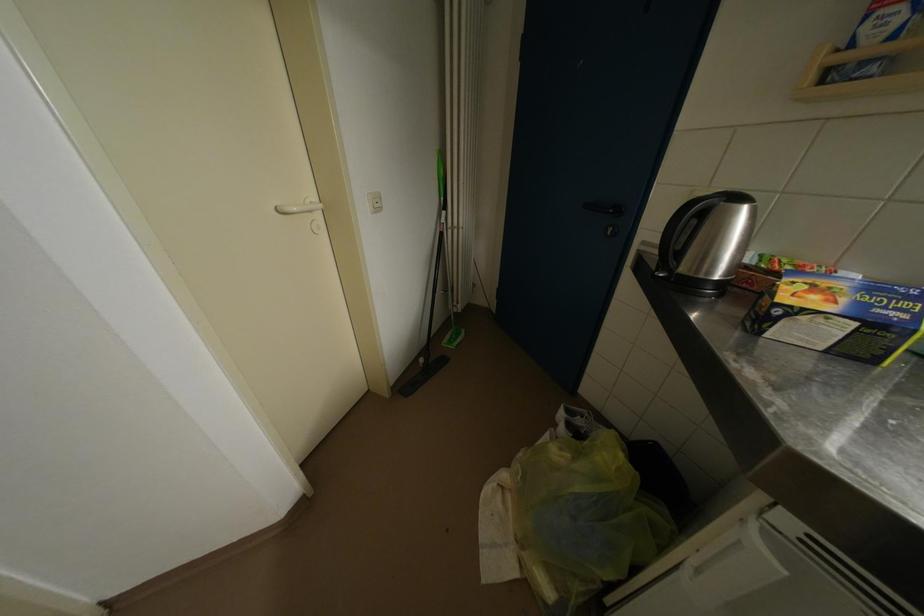
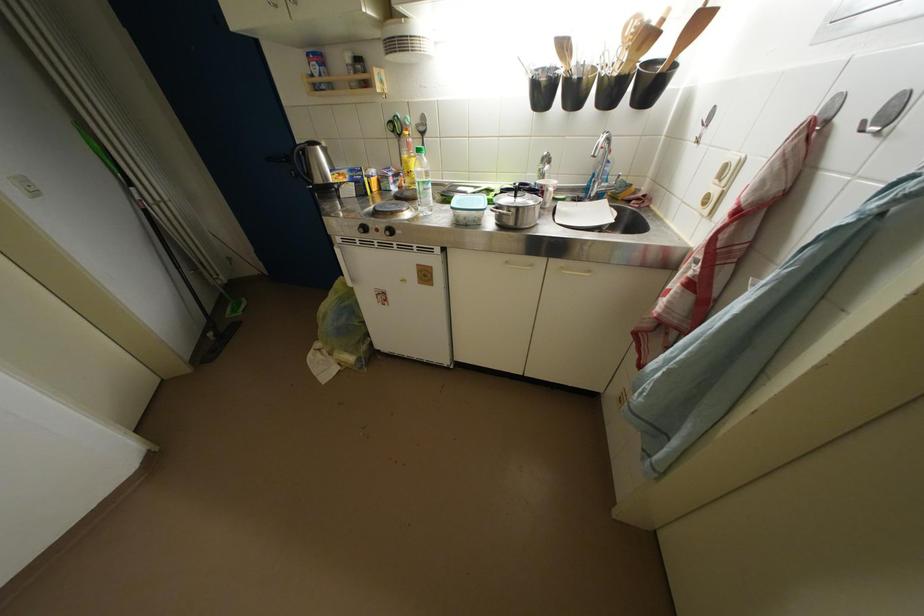
Locate, in the second image, the point that corresponds to point 752,213 in the first image.

(324, 152)